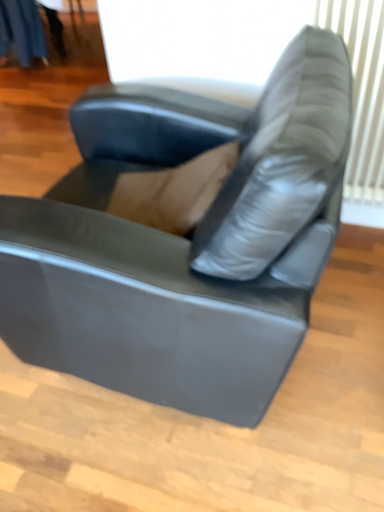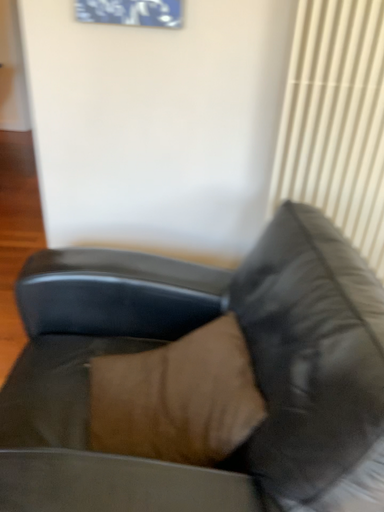
Question: Which way did the camera rotate in the video?

Choices:
 (A) rotated downward
 (B) rotated upward

Answer: (B)